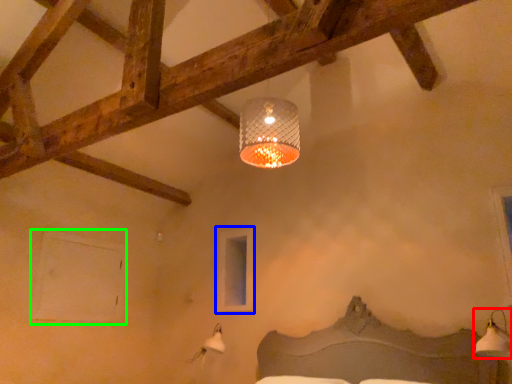
Question: Considering the real-world distances, which object is closest to lamp (highlighted by a red box)? window (highlighted by a blue box) or window (highlighted by a green box).

Choices:
 (A) window
 (B) window

Answer: (A)